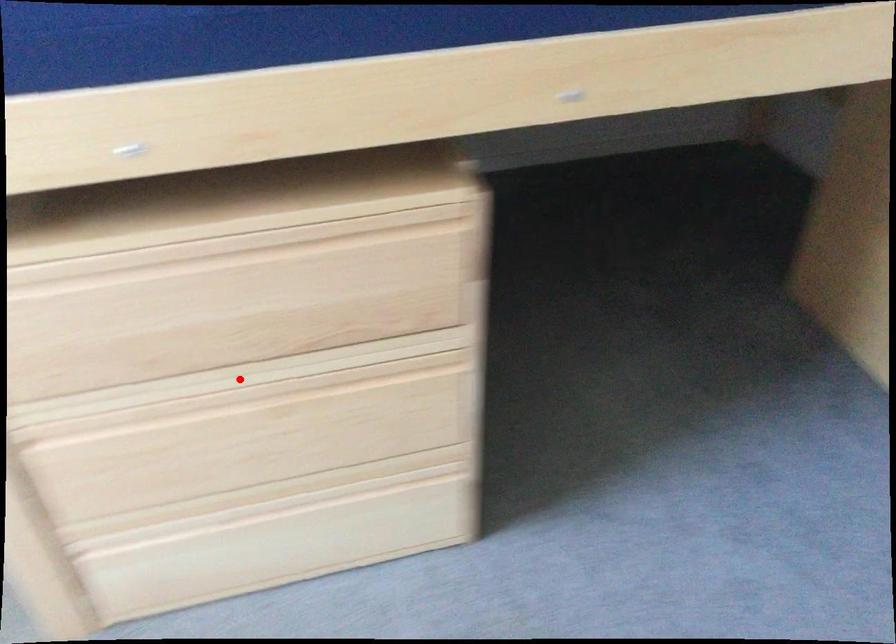
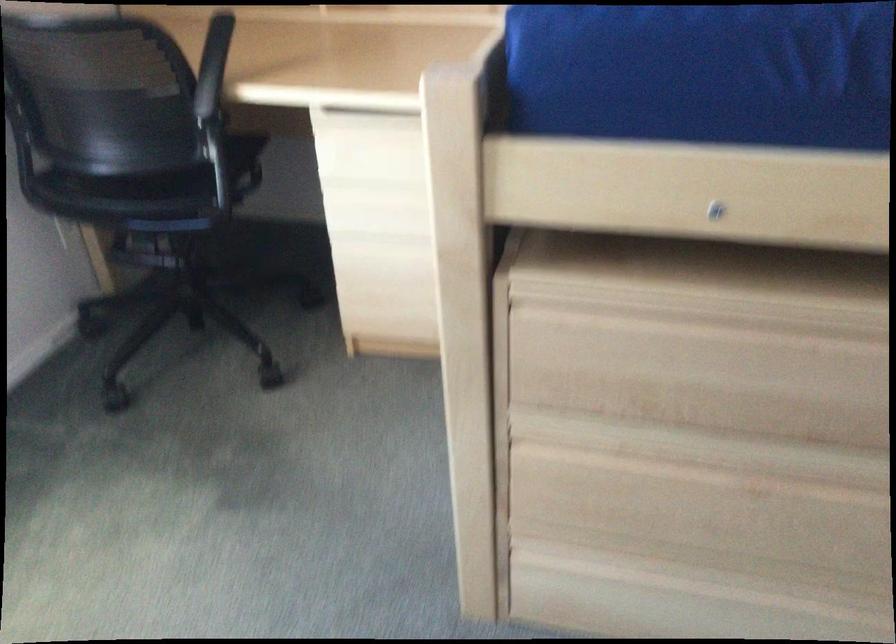
Locate, in the second image, the point that corresponds to the highlighted location in the first image.

(716, 451)